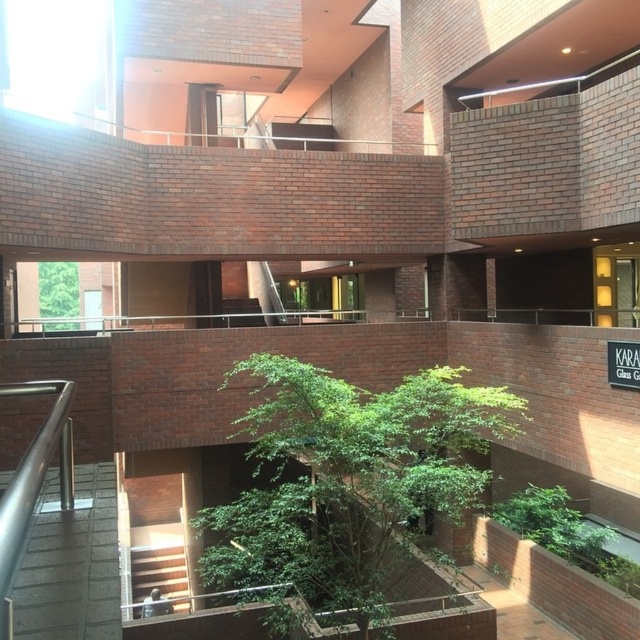
Question: Which object appears farthest from the camera in this image?

Choices:
 (A) wooden staircase at lower left
 (B) green leafy tree at center

Answer: (A)

Question: Which object appears farthest from the camera in this image?

Choices:
 (A) green leafy tree at center
 (B) wooden staircase at lower left

Answer: (B)

Question: Is green leafy tree at center above wooden staircase at lower left?

Choices:
 (A) no
 (B) yes

Answer: (B)

Question: Is green leafy tree at center wider than wooden staircase at lower left?

Choices:
 (A) yes
 (B) no

Answer: (A)

Question: Which is nearer to the wooden staircase at lower left?

Choices:
 (A) green leafy tree at center
 (B) green leafy tree at upper left

Answer: (B)

Question: Can you confirm if green leafy tree at center is smaller than wooden staircase at lower left?

Choices:
 (A) yes
 (B) no

Answer: (B)